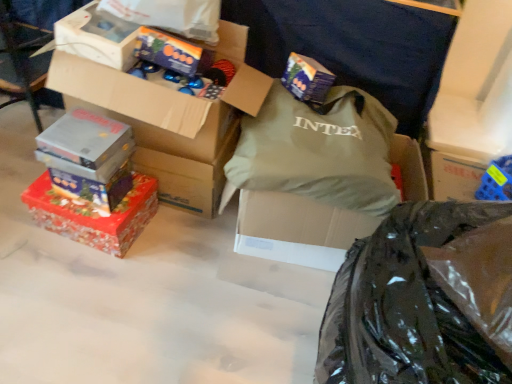
Locate an element on the screen. matte green pillow at center, acting as the 7th box starting from the left is located at coordinates (297, 229).

Describe the element at coordinates (297, 229) in the screenshot. I see `matte green pillow at center, acting as the 7th box starting from the left` at that location.

Measure the distance between metallic silver box at left, the second box positioned from the left, and camera.

They are 1.33 meters apart.

Image resolution: width=512 pixels, height=384 pixels. What do you see at coordinates (93, 189) in the screenshot?
I see `shiny metallic box at lower left, which is the fifth box in right-to-left order` at bounding box center [93, 189].

Find the location of a particular element. The width and height of the screenshot is (512, 384). shiny metallic box at lower left, which appears as the third box when viewed from the left is located at coordinates (93, 189).

What is the approximate height of shiny metallic box at upper center, which appears as the sixth box when viewed from the left?

shiny metallic box at upper center, which appears as the sixth box when viewed from the left, is 4.54 inches in height.

Where is `black glossy plastic bag at lower right`? black glossy plastic bag at lower right is located at coordinates (405, 306).

Between matte purple box at upper center and black glossy plastic bag at lower right, which one is positioned in front?

black glossy plastic bag at lower right.

In terms of width, does matte purple box at upper center look wider or thinner when compared to black glossy plastic bag at lower right?

In the image, matte purple box at upper center appears to be more narrow than black glossy plastic bag at lower right.

Where is `plastic bag located in front of the matte purple box at upper center`? This screenshot has width=512, height=384. plastic bag located in front of the matte purple box at upper center is located at coordinates point(405,306).

From a real-world perspective, does matte purple box at upper center sit lower than black glossy plastic bag at lower right?

Incorrect, from a real-world perspective, matte purple box at upper center is higher than black glossy plastic bag at lower right.

Considering the sizes of objects matte green pillow at center, acting as the 7th box starting from the left, and white plastic box at upper left, acting as the fourth box starting from the right, in the image provided, who is thinner, matte green pillow at center, acting as the 7th box starting from the left, or white plastic box at upper left, acting as the fourth box starting from the right,?

Thinner between the two is white plastic box at upper left, acting as the fourth box starting from the right.

Based on the photo, from a real-world perspective, is matte green pillow at center, which is the first box in right-to-left order, under white plastic box at upper left, placed as the fourth box when sorted from left to right?

Yes.

From the image's perspective, is matte green pillow at center, acting as the 7th box starting from the left, positioned above or below white plastic box at upper left, acting as the fourth box starting from the right?

Based on their image positions, matte green pillow at center, acting as the 7th box starting from the left, is located beneath white plastic box at upper left, acting as the fourth box starting from the right.

In the scene shown: Which is less distant, (327, 255) or (79, 45)?

Point (327, 255) appears to be farther away from the viewer than point (79, 45).

From a real-world perspective, is shiny metallic box at lower left, which is the fifth box in right-to-left order, positioned under matte purple box at upper center based on gravity?

Yes, from a real-world perspective, shiny metallic box at lower left, which is the fifth box in right-to-left order, is under matte purple box at upper center.

Considering the sizes of shiny metallic box at lower left, which is the fifth box in right-to-left order, and matte purple box at upper center in the image, is shiny metallic box at lower left, which is the fifth box in right-to-left order, wider or thinner than matte purple box at upper center?

Considering their sizes, shiny metallic box at lower left, which is the fifth box in right-to-left order, looks broader than matte purple box at upper center.

In the scene shown: Is matte purple box at upper center at the back of shiny metallic box at lower left, which appears as the third box when viewed from the left?

No, shiny metallic box at lower left, which appears as the third box when viewed from the left,'s orientation is not away from matte purple box at upper center.

Who is taller, shiny metallic box at lower left, which appears as the third box when viewed from the left, or matte purple box at upper center?

With more height is shiny metallic box at lower left, which appears as the third box when viewed from the left.

Considering the relative sizes of shiny metallic box at upper center, which appears as the sixth box when viewed from the left, and matte purple box at upper center in the image provided, is shiny metallic box at upper center, which appears as the sixth box when viewed from the left, smaller than matte purple box at upper center?

Yes, shiny metallic box at upper center, which appears as the sixth box when viewed from the left, is smaller than matte purple box at upper center.

Which point is more forward, (x=186, y=42) or (x=296, y=54)?

The point (x=186, y=42) is closer.

Based on the photo, how different are the orientations of shiny metallic box at upper center, positioned as the 2th box in right-to-left order, and matte purple box at upper center in degrees?

45.3 degrees.

Is shiny red wrapping paper at lower left, the 1th box when ordered from left to right, turned away from matte purple box at upper center?

No, matte purple box at upper center is not at the back of shiny red wrapping paper at lower left, the 1th box when ordered from left to right.

Consider the image. From a real-world perspective, which object rests below the other?

From a 3D spatial view, shiny red wrapping paper at lower left, placed as the seventh box when sorted from right to left, is below.

How different are the orientations of shiny red wrapping paper at lower left, placed as the seventh box when sorted from right to left, and matte purple box at upper center in degrees?

The angle between the facing direction of shiny red wrapping paper at lower left, placed as the seventh box when sorted from right to left, and the facing direction of matte purple box at upper center is 43.8 degrees.

Considering the sizes of shiny red wrapping paper at lower left, placed as the seventh box when sorted from right to left, and matte purple box at upper center in the image, is shiny red wrapping paper at lower left, placed as the seventh box when sorted from right to left, wider or thinner than matte purple box at upper center?

shiny red wrapping paper at lower left, placed as the seventh box when sorted from right to left, is wider than matte purple box at upper center.

From the image's perspective, between black glossy plastic bag at lower right and metallic silver box at left, the second box positioned from the left, which one is located above?

metallic silver box at left, the second box positioned from the left, appears higher in the image.

Are black glossy plastic bag at lower right and metallic silver box at left, which appears as the 6th box when viewed from the right, beside each other?

No, black glossy plastic bag at lower right is not next to metallic silver box at left, which appears as the 6th box when viewed from the right.

From a real-world perspective, which object stands above the other?

black glossy plastic bag at lower right, from a real-world perspective.

Can you tell me how much black glossy plastic bag at lower right and metallic silver box at left, the second box positioned from the left, differ in facing direction?

They differ by 1.02 degrees in their facing directions.

Does shiny metallic box at lower left, which is the fifth box in right-to-left order, appear on the right side of green fabric bag at center?

In fact, shiny metallic box at lower left, which is the fifth box in right-to-left order, is to the left of green fabric bag at center.

Is shiny metallic box at lower left, which appears as the third box when viewed from the left, aimed at green fabric bag at center?

No, shiny metallic box at lower left, which appears as the third box when viewed from the left, is not facing towards green fabric bag at center.

Does shiny metallic box at lower left, which appears as the third box when viewed from the left, have a greater width compared to green fabric bag at center?

Incorrect, the width of shiny metallic box at lower left, which appears as the third box when viewed from the left, does not surpass that of green fabric bag at center.

Measure the distance between shiny metallic box at lower left, which is the fifth box in right-to-left order, and green fabric bag at center.

26.16 inches.

Identify the location of plastic bag that is under the matte purple box at upper center (from a real-world perspective). (405, 306).

You are a GUI agent. You are given a task and a screenshot of the screen. Output one action in this format:
    pyautogui.click(x=<x>, y=<y>)
    Task: Click on the box that is the 5th one when counting downward from the white plastic box at upper left, acting as the fourth box starting from the right (from the image's perspective)
    This screenshot has width=512, height=384.
    Given the screenshot: What is the action you would take?
    pyautogui.click(x=297, y=229)

Looking at the image, which one is located closer to black glossy plastic bag at lower right, cardboard box at upper left, marked as the fifth box in a left-to-right arrangement, or green fabric bag at center?

green fabric bag at center.

Considering their positions, is black glossy plastic bag at lower right positioned closer to shiny metallic box at lower left, which is the fifth box in right-to-left order, than shiny red wrapping paper at lower left, the 1th box when ordered from left to right?

shiny red wrapping paper at lower left, the 1th box when ordered from left to right, is closer to shiny metallic box at lower left, which is the fifth box in right-to-left order.

Which object lies further to the anchor point matte green pillow at center, which is the first box in right-to-left order, green fabric bag at center or matte purple box at upper center?

matte purple box at upper center.

From the image, which object appears to be nearer to metallic silver box at left, which appears as the 6th box when viewed from the right, matte green pillow at center, acting as the 7th box starting from the left, or shiny metallic box at upper center, which appears as the sixth box when viewed from the left?

shiny metallic box at upper center, which appears as the sixth box when viewed from the left, is closer to metallic silver box at left, which appears as the 6th box when viewed from the right.

When comparing their distances from shiny metallic box at lower left, which is the fifth box in right-to-left order, does matte purple box at upper center or cardboard box at upper left, marked as the fifth box in a left-to-right arrangement, seem further?

matte purple box at upper center is further to shiny metallic box at lower left, which is the fifth box in right-to-left order.

Estimate the real-world distances between objects in this image. Which object is closer to metallic silver box at left, the second box positioned from the left, shiny metallic box at lower left, which is the fifth box in right-to-left order, or green fabric bag at center?

Among the two, shiny metallic box at lower left, which is the fifth box in right-to-left order, is located nearer to metallic silver box at left, the second box positioned from the left.

From the picture: Estimate the real-world distances between objects in this image. Which object is further from shiny red wrapping paper at lower left, placed as the seventh box when sorted from right to left, shiny metallic box at lower left, which appears as the third box when viewed from the left, or cardboard box at upper left, the 3th box viewed from the right?

cardboard box at upper left, the 3th box viewed from the right.

Estimate the real-world distances between objects in this image. Which object is closer to shiny metallic box at lower left, which appears as the third box when viewed from the left, matte green pillow at center, which is the first box in right-to-left order, or shiny metallic box at upper center, which appears as the sixth box when viewed from the left?

shiny metallic box at upper center, which appears as the sixth box when viewed from the left, is positioned closer to the anchor shiny metallic box at lower left, which appears as the third box when viewed from the left.

At what (x,y) coordinates should I click in order to perform the action: click on gift between white plastic box at upper left, placed as the fourth box when sorted from left to right, and green fabric bag at center from left to right. Please return your answer as a coordinate pair (x, y). The height and width of the screenshot is (384, 512). Looking at the image, I should click on (307, 79).

At what (x,y) coordinates should I click in order to perform the action: click on gift located between cardboard box at upper left, marked as the fifth box in a left-to-right arrangement, and green fabric bag at center in the left-right direction. Please return your answer as a coordinate pair (x, y). This screenshot has height=384, width=512. Looking at the image, I should click on (307, 79).

Where is `grocery bag located between black glossy plastic bag at lower right and matte purple box at upper center in the depth direction`? Image resolution: width=512 pixels, height=384 pixels. grocery bag located between black glossy plastic bag at lower right and matte purple box at upper center in the depth direction is located at coordinates (318, 151).

Identify the location of grocery bag between metallic silver box at left, which appears as the 6th box when viewed from the right, and black glossy plastic bag at lower right, in the horizontal direction. (318, 151).